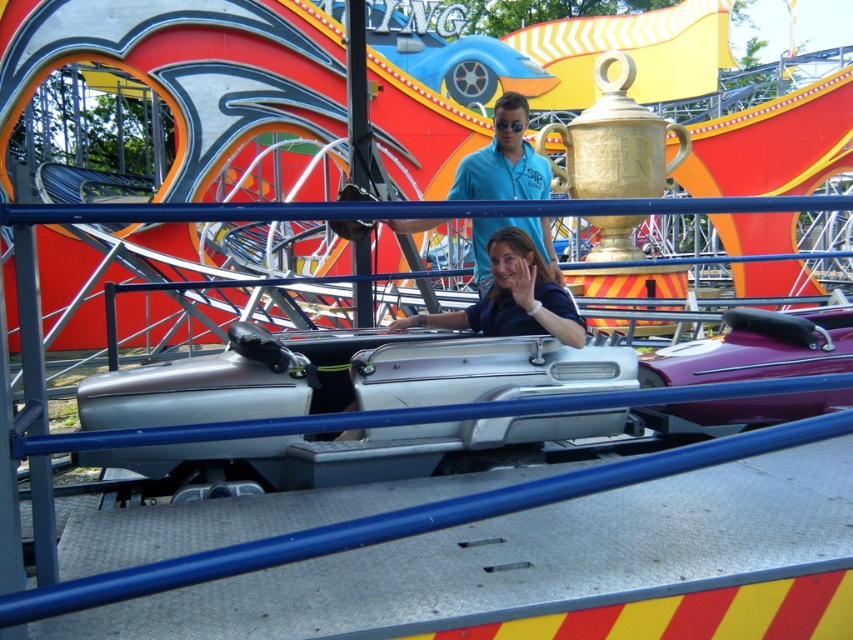
Question: Is blue cotton shirt at center positioned at the back of blue matte shirt at center?

Choices:
 (A) yes
 (B) no

Answer: (A)

Question: Can you confirm if blue cotton shirt at center is thinner than blue matte shirt at center?

Choices:
 (A) no
 (B) yes

Answer: (A)

Question: Can you confirm if blue cotton shirt at center is positioned to the right of blue matte shirt at center?

Choices:
 (A) yes
 (B) no

Answer: (A)

Question: Which point is closer to the camera?

Choices:
 (A) (560, 300)
 (B) (517, 140)

Answer: (A)